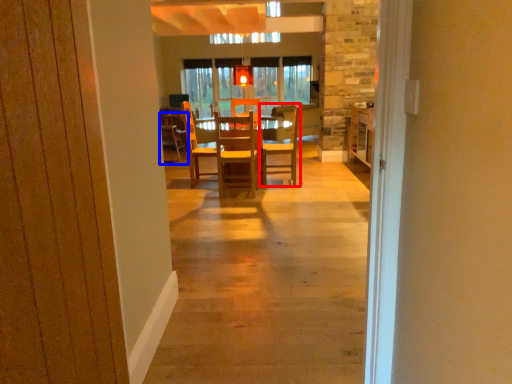
Question: Among these objects, which one is farthest to the camera, chair (highlighted by a red box) or chair (highlighted by a blue box)?

Choices:
 (A) chair
 (B) chair

Answer: (B)